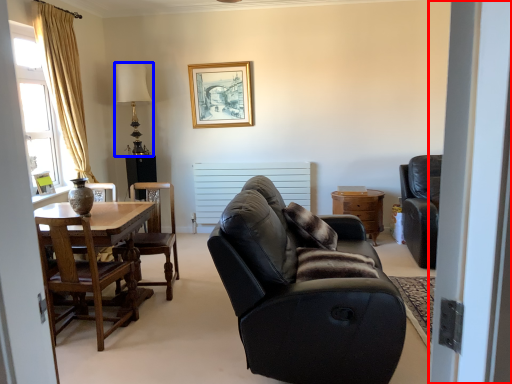
Question: Which of the following is the closest to the observer, screen door (highlighted by a red box) or lamp (highlighted by a blue box)?

Choices:
 (A) screen door
 (B) lamp

Answer: (A)